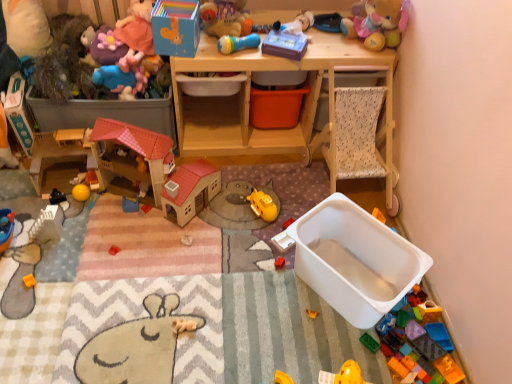
Where is `free point below soft plush toy at upper right, positioned as the second toy in right-to-left order (from a real-world perspective)`? This screenshot has height=384, width=512. free point below soft plush toy at upper right, positioned as the second toy in right-to-left order (from a real-world perspective) is located at coordinates (361, 44).